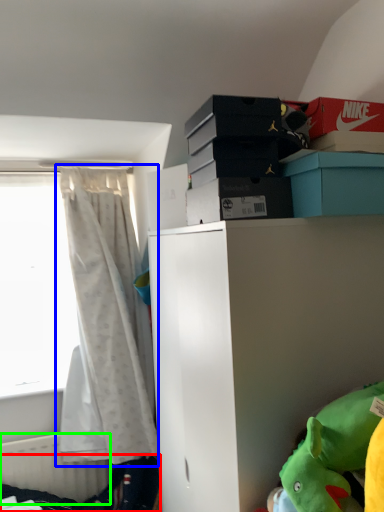
Question: Which object is positioned farthest from bed frame (highlighted by a red box)? Select from curtain (highlighted by a blue box) and radiator (highlighted by a green box).

Choices:
 (A) curtain
 (B) radiator

Answer: (A)